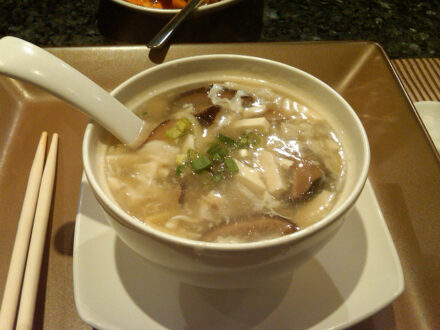
Identify the location of table top. This screenshot has width=440, height=330. (387, 25).